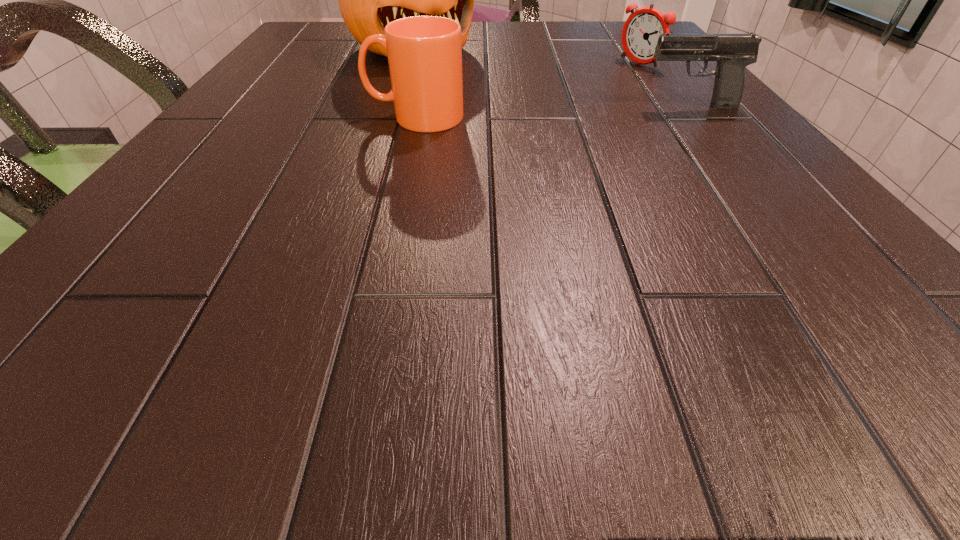
You are a GUI agent. You are given a task and a screenshot of the screen. Output one action in this format:
    pyautogui.click(x=<x>, y=<y>)
    Task: Click on the third shortest object
    This screenshot has width=960, height=540.
    Given the screenshot: What is the action you would take?
    pyautogui.click(x=424, y=53)

What are the coordinates of `pistol` in the screenshot? It's located at (733, 52).

Where is `the tallest object`? The width and height of the screenshot is (960, 540). the tallest object is located at coordinates (368, 0).

Where is `alarm clock`? This screenshot has width=960, height=540. alarm clock is located at coordinates (640, 34).

Find the location of a particular element. This screenshot has width=960, height=540. vacant space located on the handle side of the third shortest object is located at coordinates (245, 117).

This screenshot has width=960, height=540. In order to click on vacant area located on the handle side of the third shortest object in this screenshot , I will do `click(256, 117)`.

Locate an element on the screen. This screenshot has width=960, height=540. free space located on the handle side of the third shortest object is located at coordinates (228, 117).

The width and height of the screenshot is (960, 540). What are the coordinates of `free space located aim along the barrel of the pistol` in the screenshot? It's located at (571, 106).

I want to click on free region located 0.330m aim along the barrel of the pistol, so click(x=460, y=106).

Identify the location of free space located 0.220m aim along the barrel of the pistol. pos(521,106).